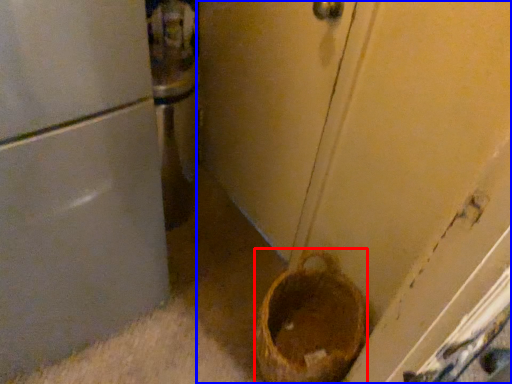
Question: Which of the following is the closest to the observer, basket container (highlighted by a red box) or door (highlighted by a blue box)?

Choices:
 (A) basket container
 (B) door

Answer: (B)